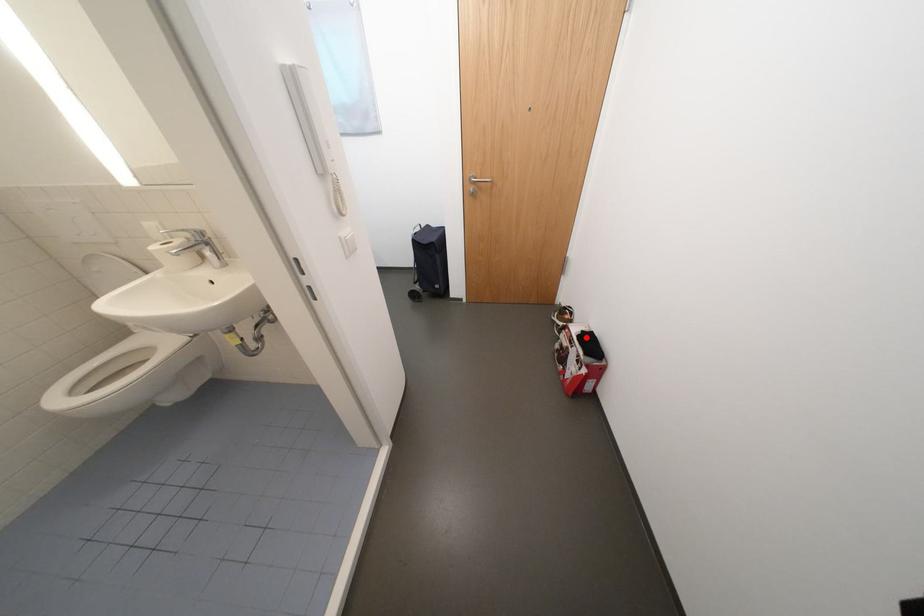
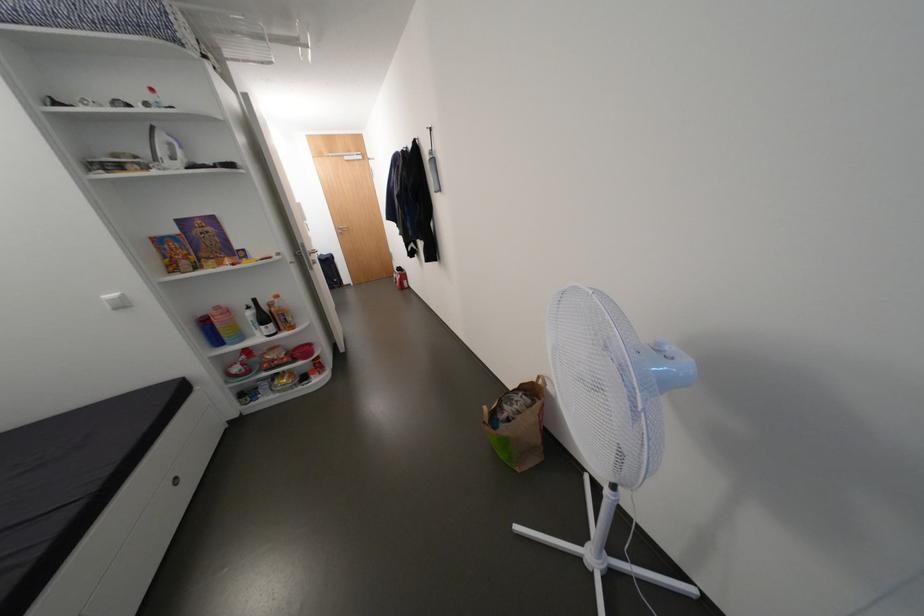
Question: I am providing you with two images of the same scene from different viewpoints. A red point is shown in image1. For the corresponding object point in image2, is it positioned nearer or farther from the camera?

Choices:
 (A) Nearer
 (B) Farther

Answer: (B)